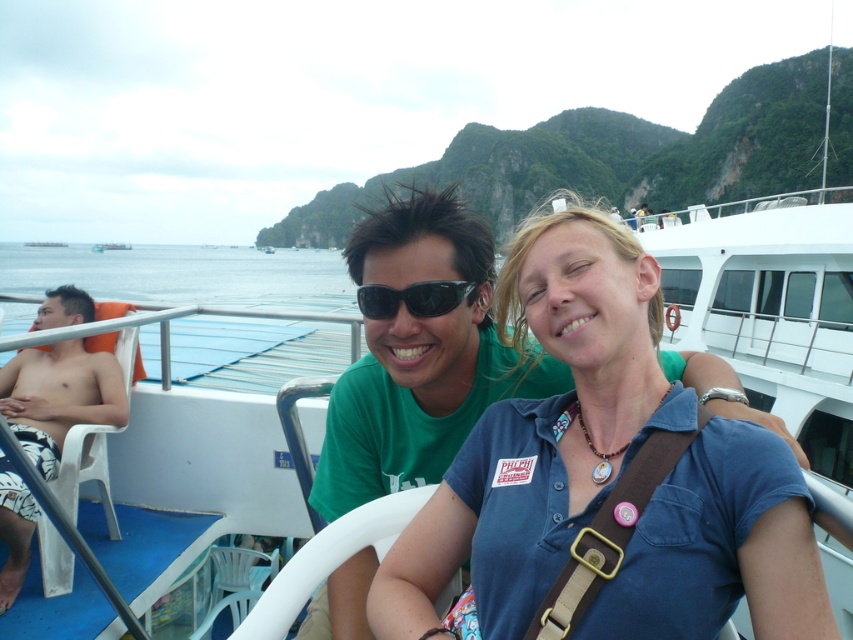
Question: Is blue cotton shirt at center below white plastic boat at center?

Choices:
 (A) yes
 (B) no

Answer: (A)

Question: Can you confirm if black plastic sunglasses at center is smaller than white plastic boat at center?

Choices:
 (A) yes
 (B) no

Answer: (A)

Question: Is white textured shorts at left positioned at the back of white plastic boat at center?

Choices:
 (A) no
 (B) yes

Answer: (A)

Question: Which object is the closest to the black plastic sunglasses at center?

Choices:
 (A) blue cotton shirt at center
 (B) white plastic boat at center

Answer: (A)

Question: Which of the following is the closest to the observer?

Choices:
 (A) (9, 528)
 (B) (660, 304)

Answer: (B)

Question: Which of the following is the closest to the observer?

Choices:
 (A) white plastic boat at center
 (B) blue cotton shirt at center
 (C) white textured shorts at left

Answer: (B)